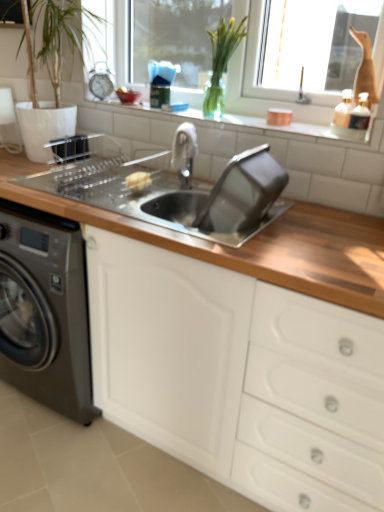
This screenshot has width=384, height=512. What are the coordinates of `free space to the right of green glass vase at upper center` in the screenshot? It's located at [x=263, y=121].